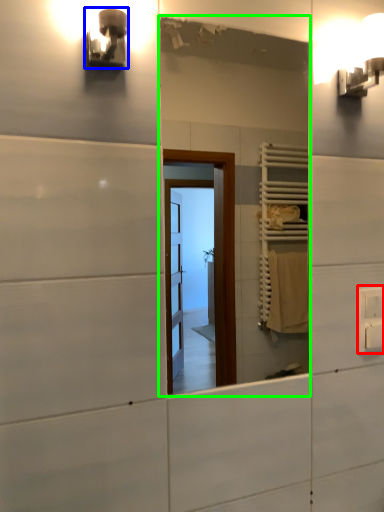
Question: Considering the real-world distances, which object is closest to electric outlet (highlighted by a red box)? light fixture (highlighted by a blue box) or mirror (highlighted by a green box).

Choices:
 (A) light fixture
 (B) mirror

Answer: (A)